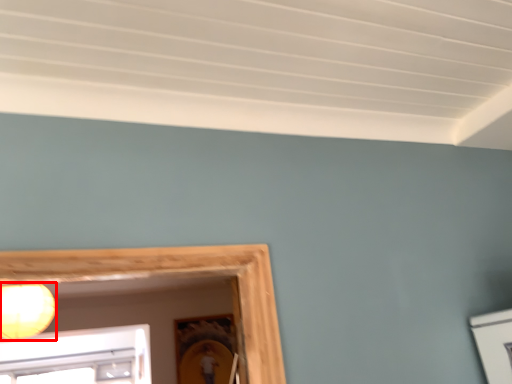
Question: Where is lamp (annotated by the red box) located in relation to picture frame in the image?

Choices:
 (A) right
 (B) left

Answer: (B)